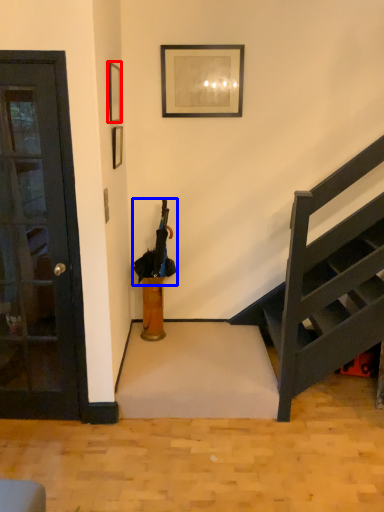
Question: Which object appears closest to the camera in this image, picture frame (highlighted by a red box) or umbrella (highlighted by a blue box)?

Choices:
 (A) picture frame
 (B) umbrella

Answer: (A)